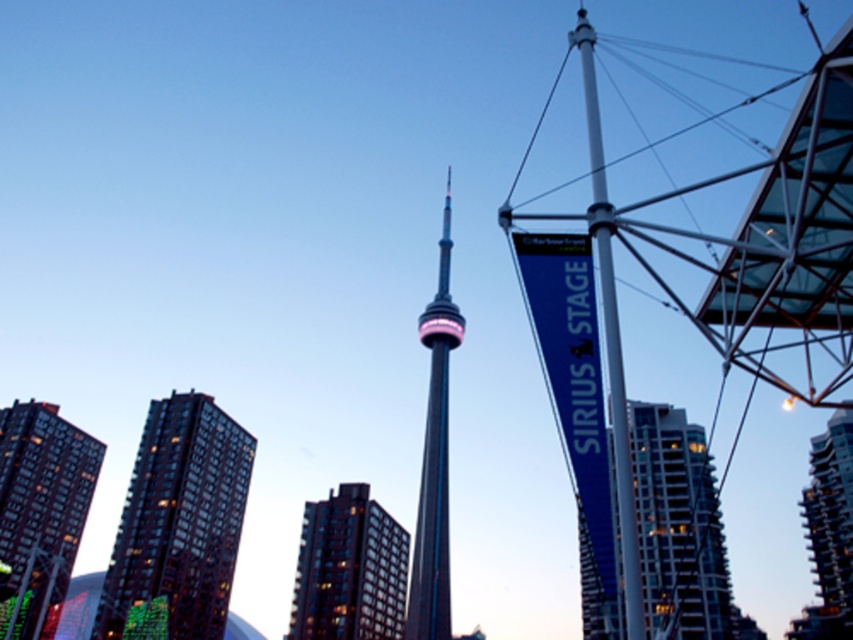
Question: Based on their relative distances, which object is farther from the shiny metallic tower at center?

Choices:
 (A) dark glass building at left
 (B) white metallic pole at center

Answer: (B)

Question: Does dark brown brick building at lower left have a greater width compared to shiny metallic tower at center?

Choices:
 (A) no
 (B) yes

Answer: (B)

Question: Is dark brown brick building at lower left to the left of dark brown glass building at center from the viewer's perspective?

Choices:
 (A) no
 (B) yes

Answer: (B)

Question: Among these points, which one is nearest to the camera?

Choices:
 (A) (24, 440)
 (B) (677, 497)
 (C) (339, 600)

Answer: (B)

Question: Where is shiny metallic tower at center located in relation to white metallic pole at center in the image?

Choices:
 (A) above
 (B) below

Answer: (A)

Question: Based on their relative distances, which object is farther from the dark brown brick building at lower left?

Choices:
 (A) shiny metallic tower at center
 (B) dark glass building at left

Answer: (A)